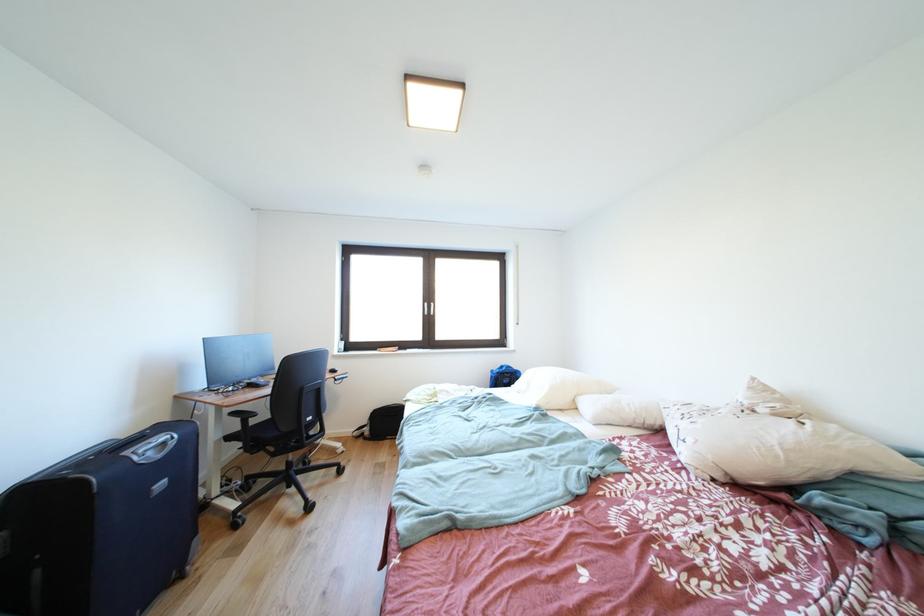
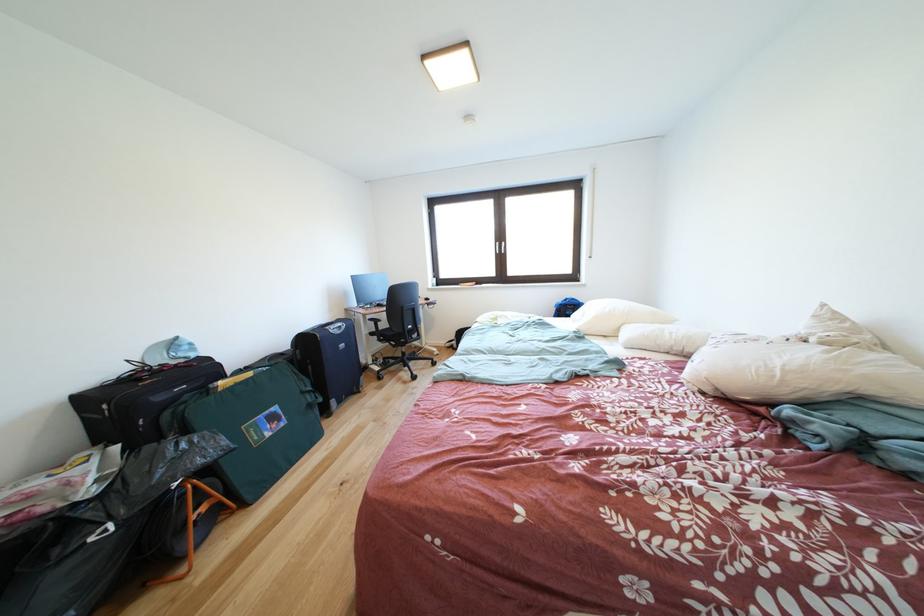
Find the pixel in the second image that matches point 167,461 in the first image.

(347, 337)